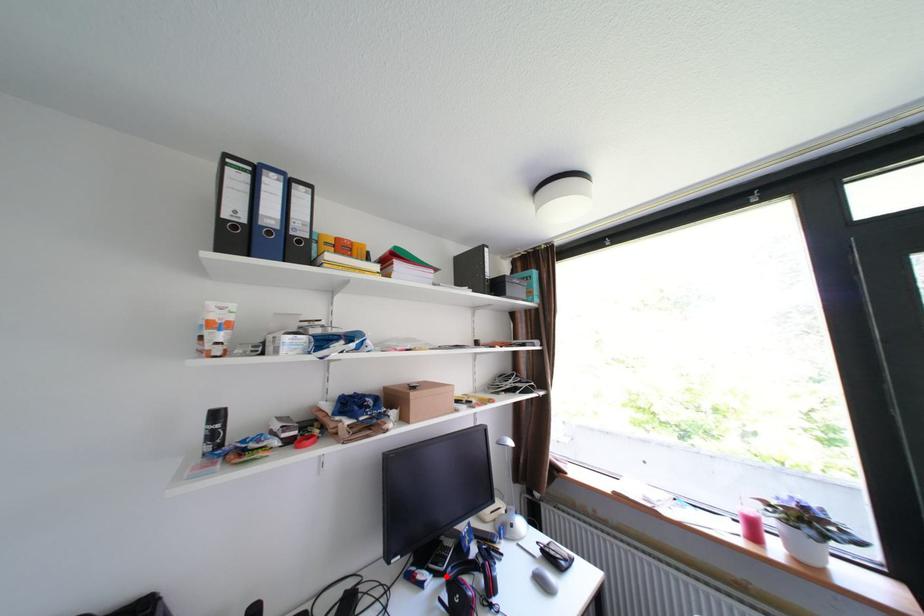
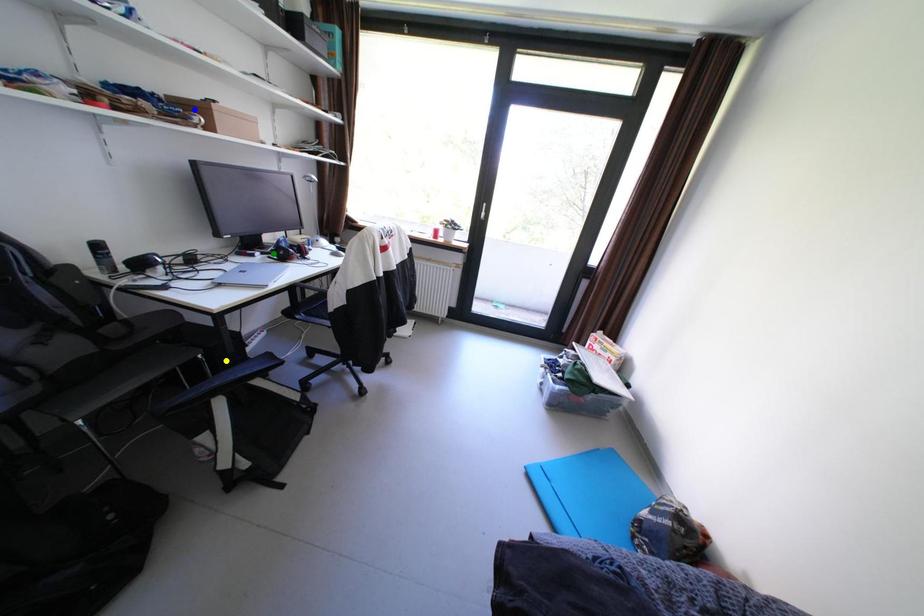
Question: I am providing you with two images of the same scene from different viewpoints. A red point is marked on the first image. You are given multiple points on the second image. Which mark in image 2 goes with the point in image 1?

Choices:
 (A) green point
 (B) yellow point
 (C) blue point

Answer: (A)